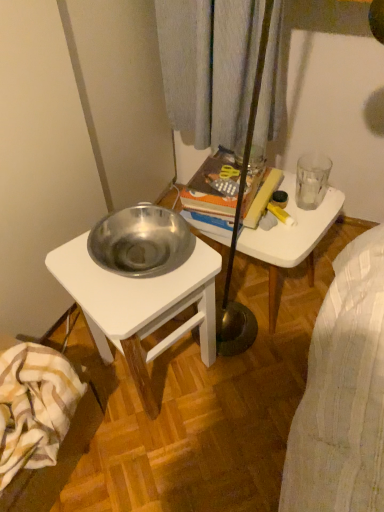
You are a GUI agent. You are given a task and a screenshot of the screen. Output one action in this format:
    pyautogui.click(x=<x>, y=<y>)
    Task: Click on the blank area beneath polished silver bowl at left (from a real-world perspective)
    The height and width of the screenshot is (512, 384).
    Given the screenshot: What is the action you would take?
    pyautogui.click(x=166, y=375)